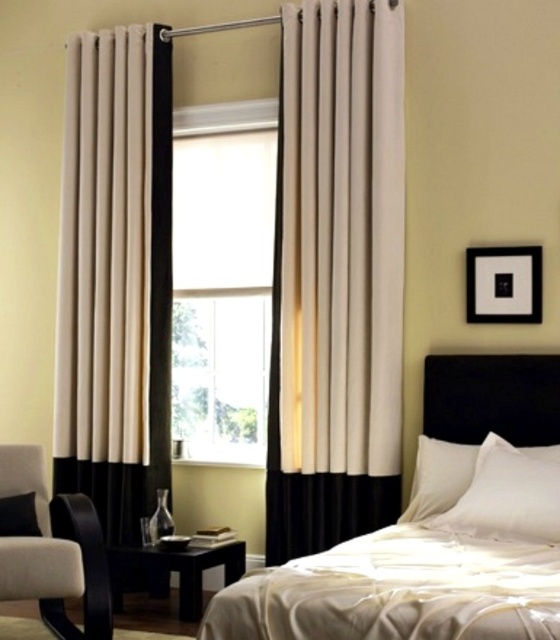
Is white satin pillow at center below white matte pillow at lower left?

Actually, white satin pillow at center is above white matte pillow at lower left.

Who is lower down, white satin pillow at center or white matte pillow at lower left?

white matte pillow at lower left is lower down.

What do you see at coordinates (508, 493) in the screenshot?
I see `white satin pillow at center` at bounding box center [508, 493].

Identify the location of white satin pillow at center. (508, 493).

Is beige fabric curtain at center in front of white matte pillow at lower left?

That is False.

Is beige fabric curtain at center bigger than white matte pillow at lower left?

Correct, beige fabric curtain at center is larger in size than white matte pillow at lower left.

Between point (316, 109) and point (11, 532), which one is positioned behind?

Positioned behind is point (316, 109).

This screenshot has height=640, width=560. I want to click on beige fabric curtain at center, so click(337, 276).

Who is positioned more to the right, beige fabric curtain at center or black glossy side table at lower left?

beige fabric curtain at center

Is point (351, 317) positioned behind point (165, 586)?

No, (351, 317) is closer to viewer.

Between point (333, 275) and point (152, 561), which one is positioned in front?

Point (152, 561)

Image resolution: width=560 pixels, height=640 pixels. What are the coordinates of `beige fabric curtain at center` in the screenshot? It's located at (337, 276).